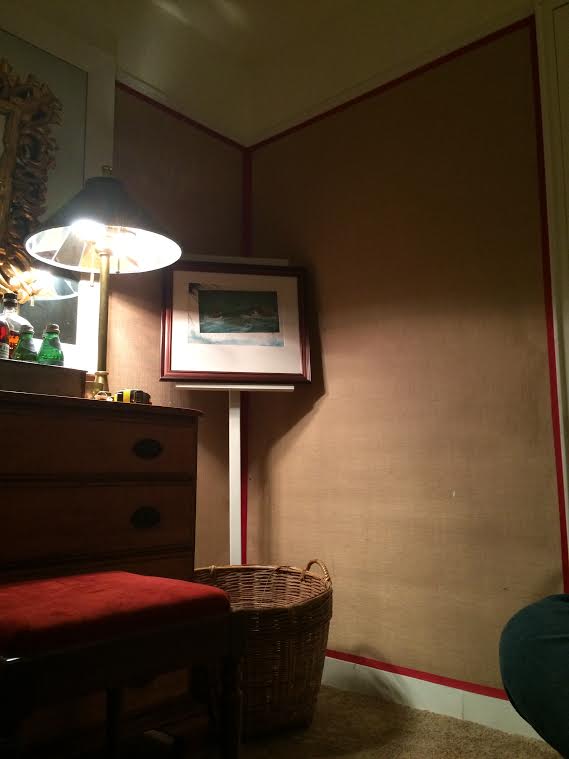
I want to click on white wood beam, so click(x=103, y=118).